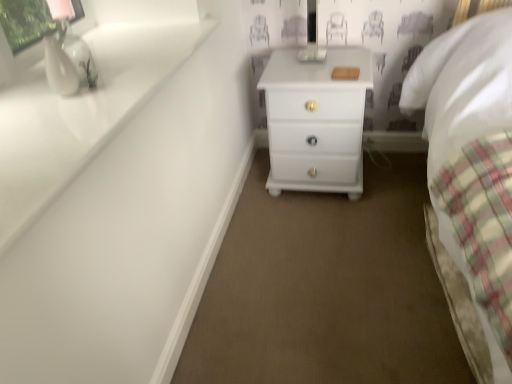
Question: From a real-world perspective, is white glossy chest of drawers at center under white glossy sink at upper left?

Choices:
 (A) no
 (B) yes

Answer: (B)

Question: Considering the relative positions of white glossy chest of drawers at center and white glossy sink at upper left in the image provided, is white glossy chest of drawers at center behind white glossy sink at upper left?

Choices:
 (A) no
 (B) yes

Answer: (B)

Question: From the image's perspective, is white glossy chest of drawers at center beneath white glossy sink at upper left?

Choices:
 (A) no
 (B) yes

Answer: (A)

Question: Is white glossy chest of drawers at center positioned in front of white glossy sink at upper left?

Choices:
 (A) yes
 (B) no

Answer: (B)

Question: Considering the relative sizes of white glossy chest of drawers at center and white glossy sink at upper left in the image provided, is white glossy chest of drawers at center bigger than white glossy sink at upper left?

Choices:
 (A) yes
 (B) no

Answer: (A)

Question: In terms of width, does white glossy sink at upper left look wider or thinner when compared to white glossy chest of drawers at center?

Choices:
 (A) wide
 (B) thin

Answer: (A)

Question: In the image, is white glossy sink at upper left positioned in front of or behind white glossy chest of drawers at center?

Choices:
 (A) front
 (B) behind

Answer: (A)

Question: Looking at the image, does white glossy sink at upper left seem bigger or smaller compared to white glossy chest of drawers at center?

Choices:
 (A) small
 (B) big

Answer: (A)

Question: From their relative heights in the image, would you say white glossy sink at upper left is taller or shorter than white glossy chest of drawers at center?

Choices:
 (A) short
 (B) tall

Answer: (A)

Question: Based on their positions, is white glossy vase at upper left located to the left or right of white glossy chest of drawers at center?

Choices:
 (A) left
 (B) right

Answer: (A)

Question: Is white glossy vase at upper left situated inside white glossy chest of drawers at center or outside?

Choices:
 (A) outside
 (B) inside

Answer: (A)

Question: Is white glossy vase at upper left wider or thinner than white glossy chest of drawers at center?

Choices:
 (A) thin
 (B) wide

Answer: (A)

Question: Is white glossy vase at upper left bigger or smaller than white glossy chest of drawers at center?

Choices:
 (A) small
 (B) big

Answer: (A)

Question: Considering the positions of white glossy sink at upper left and white glossy vase at upper left in the image, is white glossy sink at upper left wider or thinner than white glossy vase at upper left?

Choices:
 (A) wide
 (B) thin

Answer: (A)

Question: Is point (33, 190) closer or farther from the camera than point (61, 86)?

Choices:
 (A) closer
 (B) farther

Answer: (A)